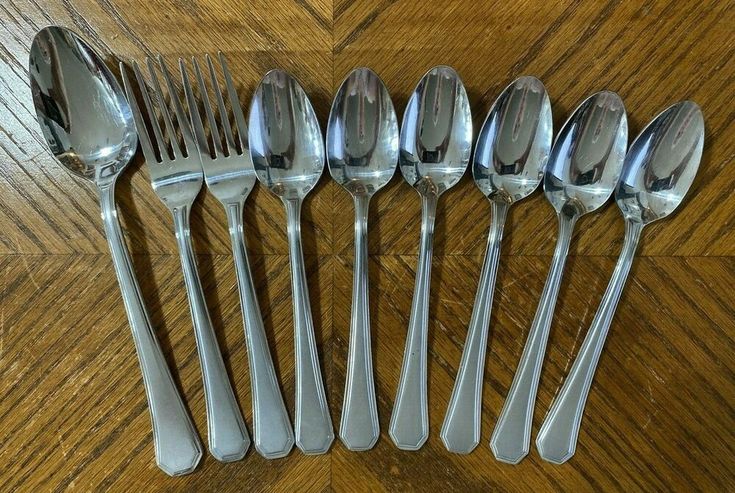
The height and width of the screenshot is (493, 735). I want to click on utensils, so pyautogui.click(x=148, y=321), pyautogui.click(x=197, y=323), pyautogui.click(x=259, y=331), pyautogui.click(x=304, y=339), pyautogui.click(x=345, y=344), pyautogui.click(x=417, y=353), pyautogui.click(x=476, y=363), pyautogui.click(x=527, y=378), pyautogui.click(x=562, y=387).